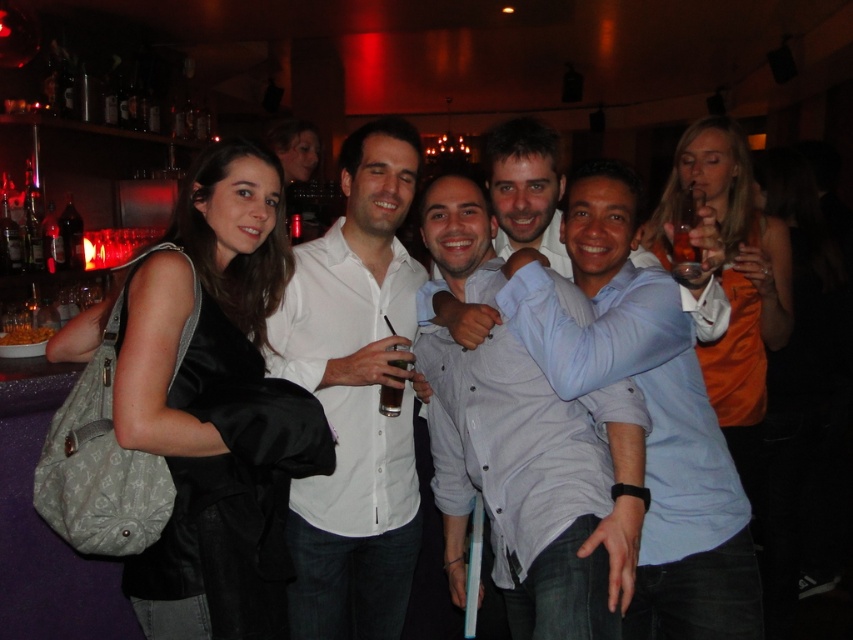
You are a photographer trying to capture a group photo of the matte black jacket at left and the orange satin dress at right. The camera you are using has a minimum focus distance of 1 meter. Can you focus on both subjects simultaneously?

The matte black jacket at left and orange satin dress at right are 1.13 meters apart from each other. Since the camera requires a minimum focus distance of 1 meter, the distance between them is sufficient for both subjects to be in focus simultaneously.

You are a photographer trying to adjust the lighting for a group photo at the bar. You need to place a spotlight to highlight the matte black jacket at left. Where should you position the spotlight relative to the group?

The matte black jacket at left is located at coordinates point (216, 404), so position the spotlight at that point to highlight it.

You are a photographer at the event and want to ensure that both the matte black jacket at left and the white shirt at center are clearly visible in the photo. Based on their positions, which one is positioned higher in the frame?

The matte black jacket at left is above the white shirt at center, so it is positioned higher in the frame.